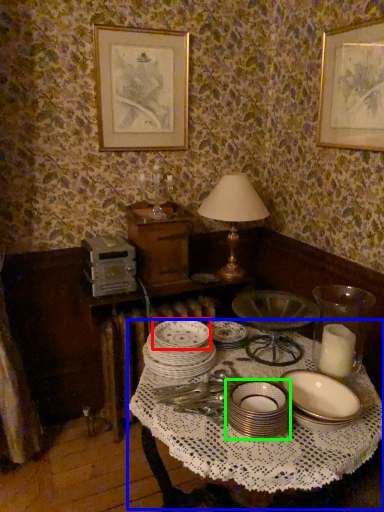
Question: Which object is positioned closest to platter (highlighted by a red box)? Select from round table (highlighted by a blue box) and tableware (highlighted by a green box).

Choices:
 (A) round table
 (B) tableware

Answer: (A)